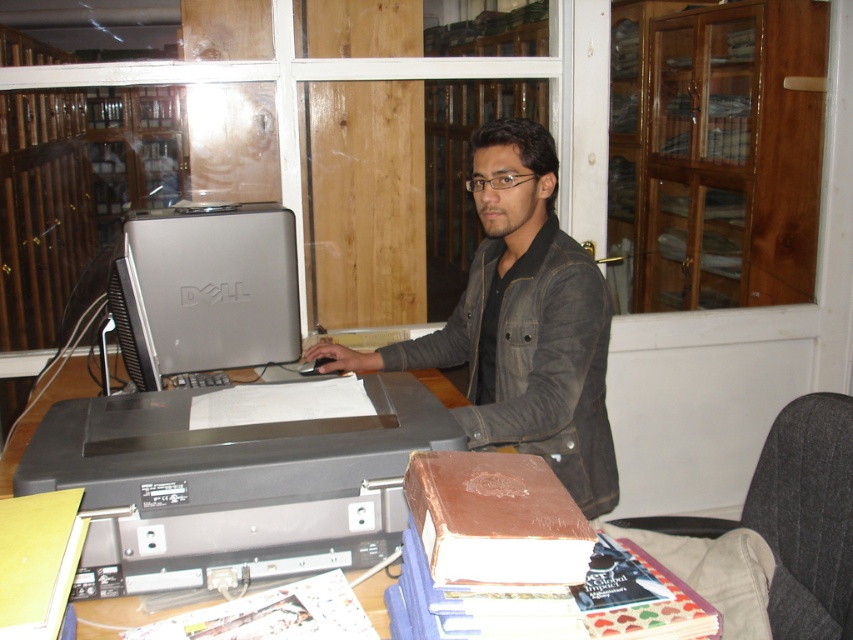
Is black plastic printer at center thinner than dark brown leather jacket at center?

Indeed, black plastic printer at center has a lesser width compared to dark brown leather jacket at center.

Which is more to the right, black plastic printer at center or dark brown leather jacket at center?

From the viewer's perspective, dark brown leather jacket at center appears more on the right side.

Locate an element on the screen. black plastic printer at center is located at coordinates (231, 484).

At what (x,y) coordinates should I click in order to perform the action: click on black plastic printer at center. Please return your answer as a coordinate pair (x, y). Looking at the image, I should click on coord(231,484).

Can you confirm if black plastic printer at center is shorter than dark gray fabric chair at lower right?

Yes.

Can you confirm if black plastic printer at center is bigger than dark gray fabric chair at lower right?

Correct, black plastic printer at center is larger in size than dark gray fabric chair at lower right.

Find the location of a particular element. black plastic printer at center is located at coordinates (231, 484).

Can you confirm if silver metallic computer at center is thinner than dark gray fabric chair at lower right?

No, silver metallic computer at center is not thinner than dark gray fabric chair at lower right.

Is silver metallic computer at center further to camera compared to dark gray fabric chair at lower right?

Yes, silver metallic computer at center is further from the viewer.

Is point (215, 301) less distant than point (840, 474)?

No, it is behind (840, 474).

I want to click on silver metallic computer at center, so click(206, 291).